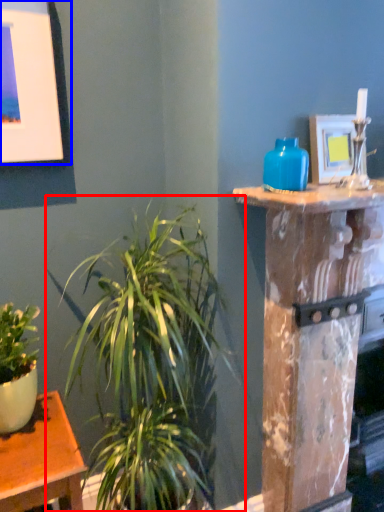
Question: Which object is closer to the camera taking this photo, houseplant (highlighted by a red box) or picture frame (highlighted by a blue box)?

Choices:
 (A) houseplant
 (B) picture frame

Answer: (A)